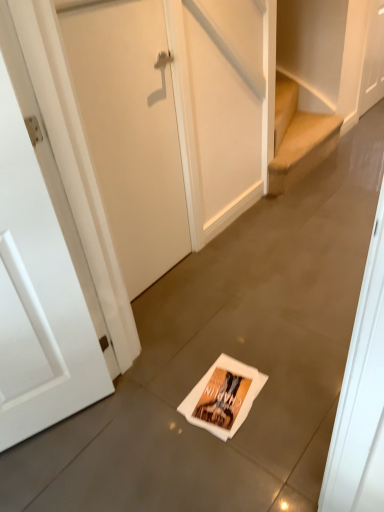
You are a GUI agent. You are given a task and a screenshot of the screen. Output one action in this format:
    pyautogui.click(x=<x>, y=<y>)
    Task: Click on the white matte door at upper right, which is the third door from front to back
    This screenshot has width=384, height=512.
    Given the screenshot: What is the action you would take?
    pyautogui.click(x=373, y=59)

Locate an element on the screen. white matte door at left, the 1th door viewed from the front is located at coordinates (38, 297).

The image size is (384, 512). In order to click on white paper flyer at center in this screenshot , I will do pyautogui.click(x=223, y=397).

The height and width of the screenshot is (512, 384). I want to click on white matte door at upper right, the 1th door when ordered from back to front, so click(x=373, y=59).

Can you tell me how much white paper flyer at center and white matte door at left, which is counted as the 1th door, starting from the bottom, differ in facing direction?

The angle between the facing direction of white paper flyer at center and the facing direction of white matte door at left, which is counted as the 1th door, starting from the bottom, is 64.2 degrees.

Is white paper flyer at center positioned far away from white matte door at left, the 3th door in the top-to-bottom sequence?

white paper flyer at center is near white matte door at left, the 3th door in the top-to-bottom sequence, not far away.

Who is taller, white paper flyer at center or white matte door at left, the 3th door in the top-to-bottom sequence?

white matte door at left, the 3th door in the top-to-bottom sequence, is taller.

Which of these two, white paper flyer at center or white matte door at left, the third door positioned from the back, is wider?

white paper flyer at center.

Does white matte door at upper right, the 1th door when ordered from back to front, come behind white matte door at left, arranged as the third door when viewed from the right?

Yes.

Is white matte door at upper right, which is the third door from front to back, placed right next to white matte door at left, arranged as the third door when viewed from the right?

white matte door at upper right, which is the third door from front to back, and white matte door at left, arranged as the third door when viewed from the right, are not in contact.

Between point (375, 42) and point (41, 245), which one is positioned in front?

Positioned in front is point (41, 245).

Considering the relative positions of white matte door at upper right, the 1th door when ordered from back to front, and white matte door at left, the 3th door in the top-to-bottom sequence, in the image provided, is white matte door at upper right, the 1th door when ordered from back to front, to the left or to the right of white matte door at left, the 3th door in the top-to-bottom sequence,?

white matte door at upper right, the 1th door when ordered from back to front, is to the right of white matte door at left, the 3th door in the top-to-bottom sequence.

Which object is thinner, white matte door at center, which appears as the second door when viewed from the left, or white matte door at left, the 1th door viewed from the front?

Thinner between the two is white matte door at center, which appears as the second door when viewed from the left.

From a real-world perspective, is white matte door at center, marked as the 2th door in a top-to-bottom arrangement, physically above white matte door at left, arranged as the third door when viewed from the right?

Yes, from a real-world perspective, white matte door at center, marked as the 2th door in a top-to-bottom arrangement, is over white matte door at left, arranged as the third door when viewed from the right

Is the surface of white matte door at center, the second door positioned from the back, in direct contact with white matte door at left, the third door positioned from the back?

white matte door at center, the second door positioned from the back, is not next to white matte door at left, the third door positioned from the back, and they're not touching.

Looking at this image, is white matte door at center, the second door in the right-to-left sequence, taller or shorter than white matte door at left, the 1th door viewed from the front?

white matte door at center, the second door in the right-to-left sequence, is shorter than white matte door at left, the 1th door viewed from the front.

Measure the distance from white matte door at upper right, acting as the 3th door starting from the bottom, to white paper flyer at center.

white matte door at upper right, acting as the 3th door starting from the bottom, is 9.12 feet away from white paper flyer at center.

Considering the positions of objects white matte door at upper right, the third door viewed from the left, and white paper flyer at center in the image provided, who is in front, white matte door at upper right, the third door viewed from the left, or white paper flyer at center?

white paper flyer at center.

Are white matte door at upper right, which appears as the first door when viewed from the right, and white paper flyer at center located far from each other?

white matte door at upper right, which appears as the first door when viewed from the right, is positioned a significant distance from white paper flyer at center.

Considering the sizes of objects white matte door at upper right, acting as the 3th door starting from the bottom, and white paper flyer at center in the image provided, who is taller, white matte door at upper right, acting as the 3th door starting from the bottom, or white paper flyer at center?

white matte door at upper right, acting as the 3th door starting from the bottom.

Based on the photo, does white matte door at upper right, the first door viewed from the top, have a lesser height compared to white matte door at center, the second door in the front-to-back sequence?

Yes.

You are a GUI agent. You are given a task and a screenshot of the screen. Output one action in this format:
    pyautogui.click(x=<x>, y=<y>)
    Task: Click on the 2nd door directly above the white matte door at upper right, which is the third door from front to back (from a real-world perspective)
    The height and width of the screenshot is (512, 384).
    Given the screenshot: What is the action you would take?
    pyautogui.click(x=131, y=132)

From the image's perspective, is white matte door at upper right, the 1th door when ordered from back to front, above white matte door at center, the second door positioned from the back?

Yes, from the image's perspective, white matte door at upper right, the 1th door when ordered from back to front, is on top of white matte door at center, the second door positioned from the back.

From a real-world perspective, is white matte door at upper right, the 1th door when ordered from back to front, above or below white matte door at center, which appears as the second door when viewed from the left?

white matte door at upper right, the 1th door when ordered from back to front, is below white matte door at center, which appears as the second door when viewed from the left.

Is white paper flyer at center facing towards white matte door at center, the second door in the front-to-back sequence?

No, white paper flyer at center does not turn towards white matte door at center, the second door in the front-to-back sequence.

How different are the orientations of white paper flyer at center and white matte door at center, marked as the 2th door in a top-to-bottom arrangement, in degrees?

They differ by 83.4 degrees in their facing directions.

Can you confirm if white paper flyer at center is wider than white matte door at center, the second door in the front-to-back sequence?

Yes.

Is point (224, 374) positioned behind point (81, 17)?

Yes, point (224, 374) is behind point (81, 17).

Which is less distant, (239, 402) or (368, 84)?

The point (239, 402) is in front.

From a real-world perspective, starting from the white paper flyer at center, which door is the 1st one vertically above it? Please provide its 2D coordinates.

[(373, 59)]

From the image's perspective, which one is positioned higher, white paper flyer at center or white matte door at upper right, the third door viewed from the left?

white matte door at upper right, the third door viewed from the left, appears higher in the image.

Is white paper flyer at center beside white matte door at upper right, which appears as the first door when viewed from the right?

No.

Find the location of a particular element. This screenshot has width=384, height=512. the 1st door above the white paper flyer at center (from the image's perspective) is located at coordinates (38, 297).

Identify the location of door that is the 2nd object located below the white matte door at upper right, acting as the 3th door starting from the bottom (from the image's perspective). Image resolution: width=384 pixels, height=512 pixels. (38, 297).

Which object lies nearer to the anchor point white matte door at upper right, the first door viewed from the top, white matte door at center, positioned as the second door in bottom-to-top order, or white matte door at left, marked as the 1th door in a left-to-right arrangement?

Based on the image, white matte door at center, positioned as the second door in bottom-to-top order, appears to be nearer to white matte door at upper right, the first door viewed from the top.

Estimate the real-world distances between objects in this image. Which object is closer to white matte door at center, marked as the 2th door in a top-to-bottom arrangement, white matte door at left, the third door positioned from the back, or white paper flyer at center?

white matte door at left, the third door positioned from the back, is closer to white matte door at center, marked as the 2th door in a top-to-bottom arrangement.

From the image, which object appears to be farther from white matte door at upper right, acting as the 3th door starting from the bottom, white paper flyer at center or white matte door at center, which appears as the second door when viewed from the left?

The object further to white matte door at upper right, acting as the 3th door starting from the bottom, is white paper flyer at center.

Estimate the real-world distances between objects in this image. Which object is closer to white matte door at center, the second door in the right-to-left sequence, white paper flyer at center or white matte door at upper right, the 1th door when ordered from back to front?

white paper flyer at center is closer to white matte door at center, the second door in the right-to-left sequence.

Which object lies further to the anchor point white matte door at upper right, the 1th door when ordered from back to front, white matte door at center, marked as the 2th door in a top-to-bottom arrangement, or white paper flyer at center?

white paper flyer at center lies further to white matte door at upper right, the 1th door when ordered from back to front, than the other object.

Estimate the real-world distances between objects in this image. Which object is further from white matte door at upper right, which appears as the first door when viewed from the right, white matte door at left, arranged as the third door when viewed from the right, or white paper flyer at center?

Answer: Among the two, white matte door at left, arranged as the third door when viewed from the right, is located further to white matte door at upper right, which appears as the first door when viewed from the right.

Estimate the real-world distances between objects in this image. Which object is further from white matte door at center, the second door in the right-to-left sequence, white matte door at upper right, the third door viewed from the left, or white paper flyer at center?

white matte door at upper right, the third door viewed from the left, lies further to white matte door at center, the second door in the right-to-left sequence, than the other object.

Considering their positions, is white matte door at upper right, the 1th door when ordered from back to front, positioned further to white matte door at left, the third door positioned from the back, than white paper flyer at center?

The object further to white matte door at left, the third door positioned from the back, is white matte door at upper right, the 1th door when ordered from back to front.

This screenshot has height=512, width=384. What are the coordinates of `flyer between white matte door at left, the 3th door in the top-to-bottom sequence, and white matte door at upper right, the 1th door when ordered from back to front, along the z-axis` in the screenshot? It's located at (223, 397).

I want to click on door between white matte door at center, marked as the 2th door in a top-to-bottom arrangement, and white paper flyer at center, in the vertical direction, so click(38, 297).

Identify the location of door between white matte door at left, the 3th door in the top-to-bottom sequence, and white matte door at upper right, which appears as the first door when viewed from the right, in the front-back direction. (131, 132).